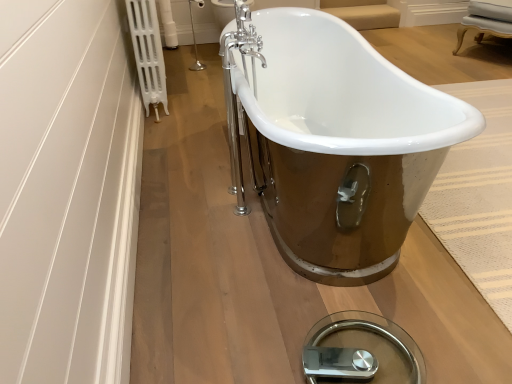
Question: Does white plastic radiator at upper left come behind chrome metallic faucet at upper center?

Choices:
 (A) yes
 (B) no

Answer: (B)

Question: From a real-world perspective, is white plastic radiator at upper left below chrome metallic faucet at upper center?

Choices:
 (A) yes
 (B) no

Answer: (B)

Question: Can you confirm if white plastic radiator at upper left is bigger than chrome metallic faucet at upper center?

Choices:
 (A) yes
 (B) no

Answer: (A)

Question: Is white plastic radiator at upper left completely or partially outside of chrome metallic faucet at upper center?

Choices:
 (A) no
 (B) yes

Answer: (B)

Question: From a real-world perspective, is white plastic radiator at upper left over chrome metallic faucet at upper center?

Choices:
 (A) no
 (B) yes

Answer: (B)

Question: Can you confirm if white plastic radiator at upper left is taller than chrome metallic faucet at upper center?

Choices:
 (A) yes
 (B) no

Answer: (A)

Question: Could you tell me if chrome metallic faucet at upper center is facing white porcelain bathtub at center?

Choices:
 (A) no
 (B) yes

Answer: (A)

Question: Is chrome metallic faucet at upper center positioned before white porcelain bathtub at center?

Choices:
 (A) no
 (B) yes

Answer: (A)

Question: Would you say chrome metallic faucet at upper center is outside white porcelain bathtub at center?

Choices:
 (A) no
 (B) yes

Answer: (B)

Question: Can you confirm if chrome metallic faucet at upper center is taller than white porcelain bathtub at center?

Choices:
 (A) yes
 (B) no

Answer: (A)

Question: Is white porcelain bathtub at center completely or partially inside chrome metallic faucet at upper center?

Choices:
 (A) no
 (B) yes

Answer: (A)

Question: Would you say chrome metallic faucet at upper center is a long distance from white porcelain bathtub at center?

Choices:
 (A) no
 (B) yes

Answer: (B)

Question: Is white plastic radiator at upper left behind white porcelain bathtub at center?

Choices:
 (A) yes
 (B) no

Answer: (A)